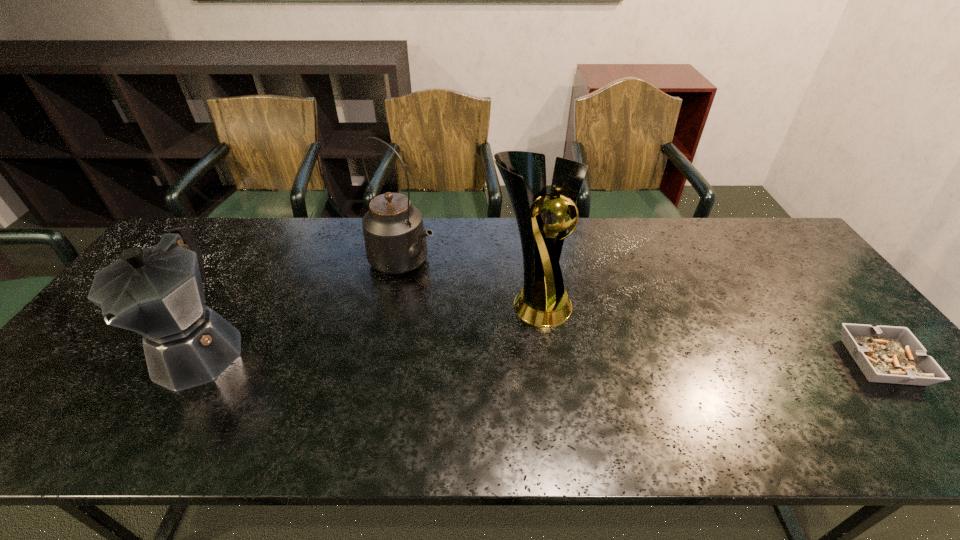
Locate an element on the screen. This screenshot has height=540, width=960. blank space at the near edge is located at coordinates (475, 381).

This screenshot has width=960, height=540. In the image, there is a desktop. Find the location of `vacant space at the left edge`. vacant space at the left edge is located at coordinates (105, 330).

Locate an element on the screen. This screenshot has height=540, width=960. vacant space at the right edge of the desktop is located at coordinates (833, 353).

Image resolution: width=960 pixels, height=540 pixels. In the image, there is a desktop. In order to click on vacant space at the far left corner in this screenshot , I will do `click(216, 241)`.

Identify the location of free space at the far right corner of the desktop. (730, 221).

Locate an element on the screen. The width and height of the screenshot is (960, 540). free space between the award and the third shortest object is located at coordinates (468, 282).

You are a GUI agent. You are given a task and a screenshot of the screen. Output one action in this format:
    pyautogui.click(x=<x>, y=<y>)
    Task: Click on the vacant point located between the shortest object and the third shortest object
    Image resolution: width=960 pixels, height=540 pixels.
    Given the screenshot: What is the action you would take?
    pyautogui.click(x=642, y=312)

Image resolution: width=960 pixels, height=540 pixels. Identify the location of unoccupied position between the second object from left to right and the second object from right to left. (468, 282).

Image resolution: width=960 pixels, height=540 pixels. I want to click on free space between the rightmost object and the third tallest object, so click(x=541, y=356).

Identify the location of free spot between the shortest object and the third shortest object. (642, 312).